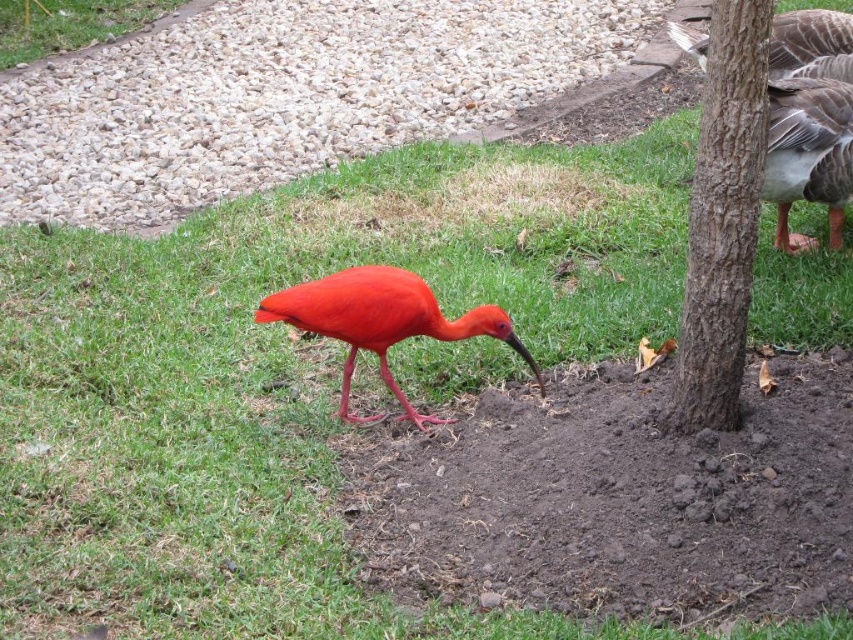
Does point (726, 353) come closer to viewer compared to point (788, 150)?

Yes, point (726, 353) is closer to viewer.

Describe the element at coordinates (722, 221) in the screenshot. I see `brown rough bark at right` at that location.

Locate an element on the screen. Image resolution: width=853 pixels, height=640 pixels. brown rough bark at right is located at coordinates (722, 221).

Is brown rough bark at right wider than matte red ibis at center?

No.

Is the position of brown rough bark at right more distant than that of matte red ibis at center?

No, it is in front of matte red ibis at center.

Between point (711, 122) and point (312, 289), which one is positioned in front?

Point (711, 122) is in front.

Identify the location of brown rough bark at right. The height and width of the screenshot is (640, 853). (722, 221).

Does brown rough bark at right have a greater height compared to green grass at upper left?

Correct, brown rough bark at right is much taller as green grass at upper left.

Who is higher up, brown rough bark at right or green grass at upper left?

green grass at upper left is higher up.

Locate an element on the screen. The width and height of the screenshot is (853, 640). brown rough bark at right is located at coordinates (722, 221).

Identify the location of brown rough bark at right. (722, 221).